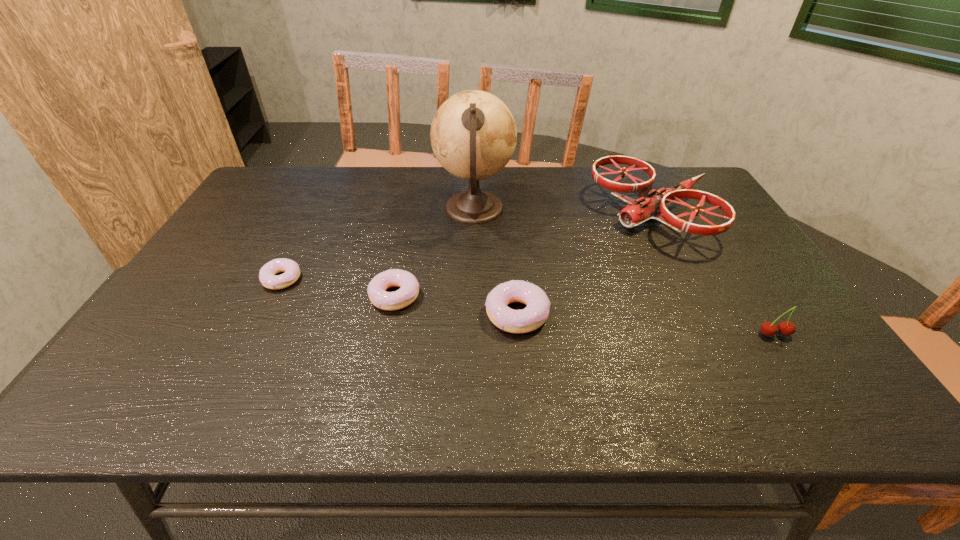
The width and height of the screenshot is (960, 540). Identify the location of the shortest object. (267, 273).

Locate an element on the screen. The height and width of the screenshot is (540, 960). the leftmost doughnut is located at coordinates (267, 273).

You are a GUI agent. You are given a task and a screenshot of the screen. Output one action in this format:
    pyautogui.click(x=<x>, y=<y>)
    Task: Click on the second doughnut from left to right
    Image resolution: width=960 pixels, height=540 pixels.
    Given the screenshot: What is the action you would take?
    pyautogui.click(x=409, y=290)

Where is `the second shortest doughnut`? the second shortest doughnut is located at coordinates (409, 290).

Locate an element on the screen. This screenshot has width=960, height=540. the rightmost doughnut is located at coordinates (534, 315).

This screenshot has height=540, width=960. Identify the location of the tallest doughnut. (534, 315).

Identify the location of the fifth shortest object. (649, 206).

This screenshot has width=960, height=540. I want to click on the tallest object, so click(473, 134).

Find the location of a particular element. cherry is located at coordinates (786, 328).

Identify the location of free space located 0.340m on the back of the leftmost doughnut. This screenshot has width=960, height=540. point(322,198).